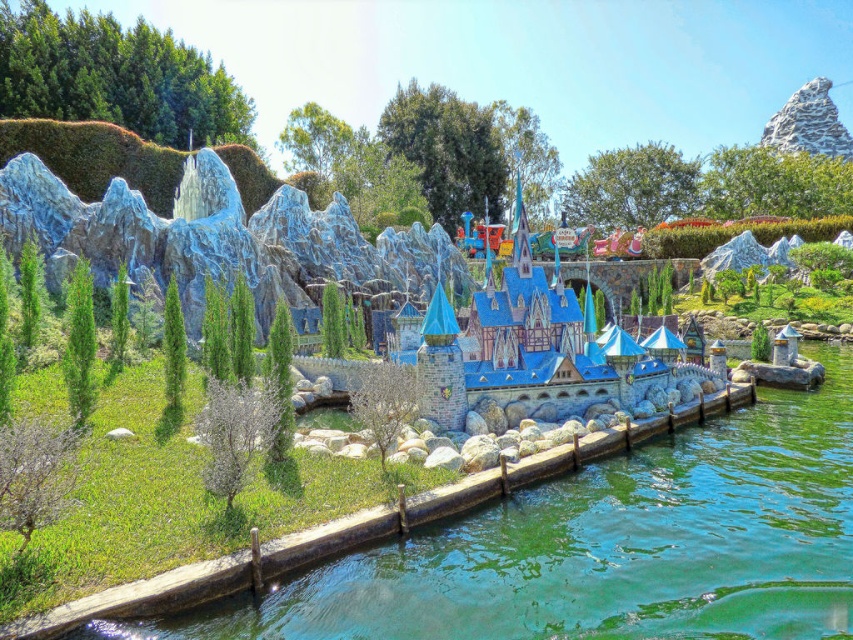
Question: Can you confirm if green leafy hedge at upper left is positioned to the left of green matte tree at left?

Choices:
 (A) yes
 (B) no

Answer: (A)

Question: Estimate the real-world distances between objects in this image. Which object is farther from the green leafy tree at center?

Choices:
 (A) green leafy tree at upper center
 (B) green leafy tree at upper right

Answer: (B)

Question: Observing the image, what is the correct spatial positioning of green leafy tree at center in reference to green matte tree at left?

Choices:
 (A) above
 (B) below

Answer: (B)

Question: Based on their relative distances, which object is nearer to the green leafy hedge at upper left?

Choices:
 (A) green leafy tree at center
 (B) green leafy tree at upper right
 (C) green stone lake at center

Answer: (A)

Question: Which point is closer to the camera?

Choices:
 (A) green stone lake at center
 (B) green fuzzy bush at lower left

Answer: (A)

Question: Does green stone lake at center appear on the right side of green leafy tree at upper right?

Choices:
 (A) no
 (B) yes

Answer: (A)